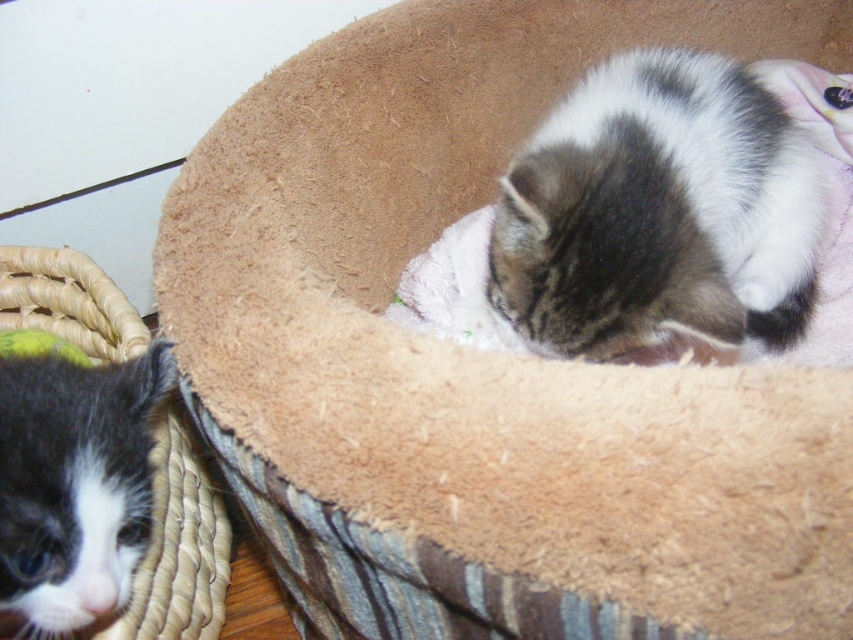
Is the position of tabby fur cat at upper right less distant than that of black and white fur at left?

No.

Is tabby fur cat at upper right below black and white fur at left?

No.

Which is behind, point (509, 294) or point (38, 572)?

The point (509, 294) is behind.

Image resolution: width=853 pixels, height=640 pixels. Find the location of `tabby fur cat at upper right`. tabby fur cat at upper right is located at coordinates (659, 212).